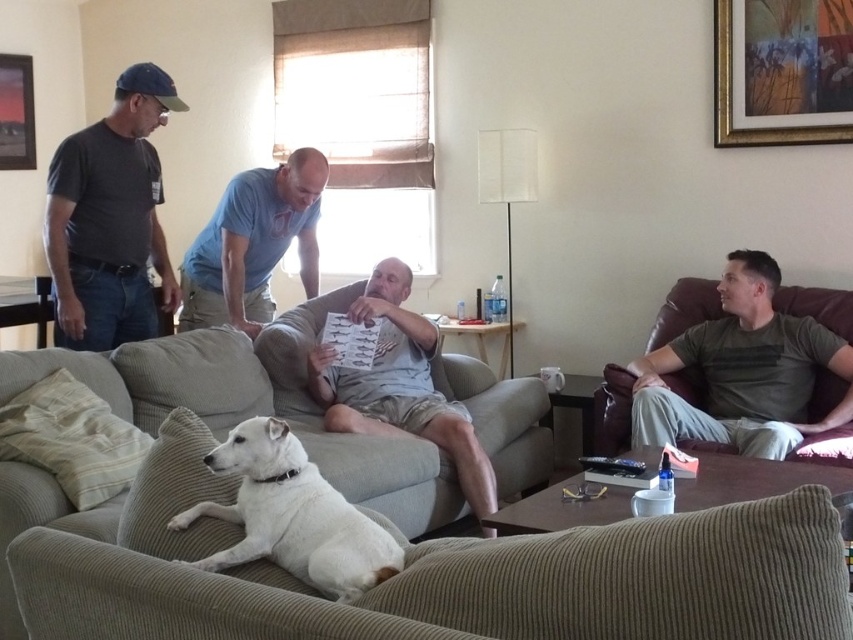
Question: Considering the relative positions of gray cotton shirt at center and metallic picture frame at upper left in the image provided, where is gray cotton shirt at center located with respect to metallic picture frame at upper left?

Choices:
 (A) right
 (B) left

Answer: (A)

Question: Among these objects, which one is farthest from the camera?

Choices:
 (A) white fur dog at center
 (B) dark gray t-shirt at left
 (C) green cotton shirt at right

Answer: (B)

Question: From the image, what is the correct spatial relationship of beige corduroy couch at center in relation to dark gray t-shirt at left?

Choices:
 (A) left
 (B) right

Answer: (B)

Question: Which of the following is the closest to the observer?

Choices:
 (A) (65, 300)
 (B) (28, 58)
 (C) (335, 600)
 (D) (722, 346)

Answer: (C)

Question: Which point is closer to the camera?

Choices:
 (A) beige corduroy couch at center
 (B) gold-framed artwork at upper right
 (C) green cotton shirt at right
 (D) blue cotton shirt at center

Answer: (A)

Question: Is dark gray t-shirt at left wider than gray cotton shirt at center?

Choices:
 (A) yes
 (B) no

Answer: (B)